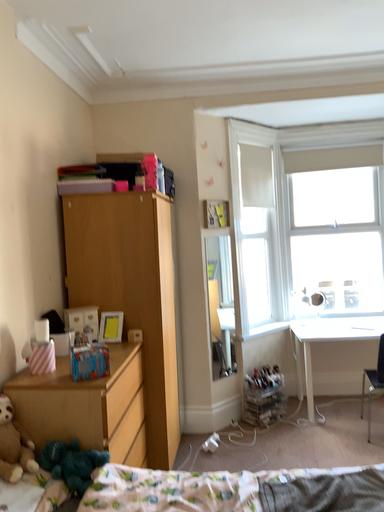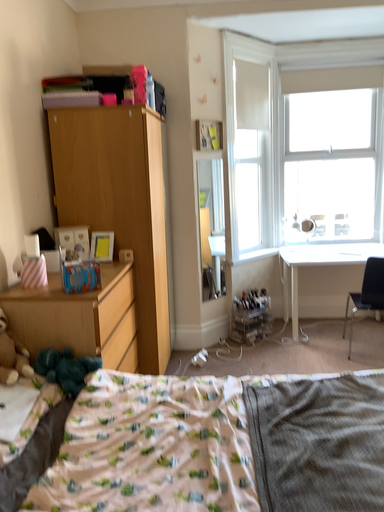
Question: How did the camera likely rotate when shooting the video?

Choices:
 (A) rotated downward
 (B) rotated upward

Answer: (A)